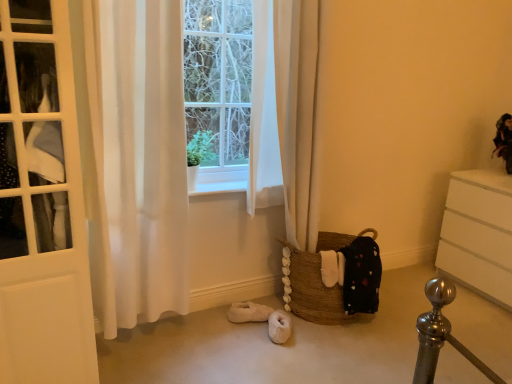
Question: In terms of height, does brown woven basket at lower center look taller or shorter compared to velvet-like doll at upper right?

Choices:
 (A) short
 (B) tall

Answer: (B)

Question: In terms of width, does brown woven basket at lower center look wider or thinner when compared to velvet-like doll at upper right?

Choices:
 (A) thin
 (B) wide

Answer: (B)

Question: Estimate the real-world distances between objects in this image. Which object is farther from the white matte chest of drawers at right?

Choices:
 (A) velvet-like doll at upper right
 (B) white sheer curtain at left
 (C) brown woven basket at lower center
 (D) white wood at center

Answer: (B)

Question: Which is farther from the white matte chest of drawers at right?

Choices:
 (A) brown woven basket at lower center
 (B) velvet-like doll at upper right
 (C) white wood at center
 (D) white sheer curtain at left

Answer: (D)